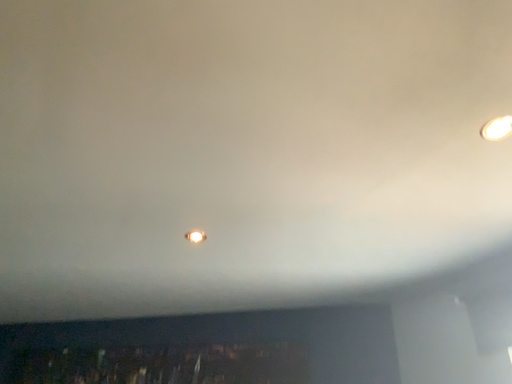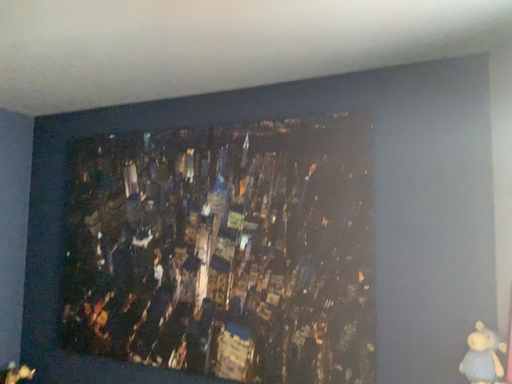
Question: How did the camera likely rotate when shooting the video?

Choices:
 (A) rotated upward
 (B) rotated downward

Answer: (B)